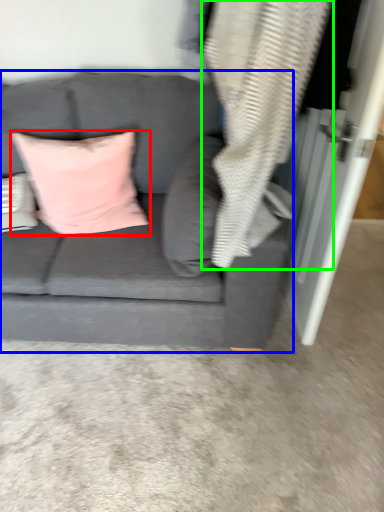
Question: Which is nearer to the pillow (highlighted by a red box)? studio couch (highlighted by a blue box) or material (highlighted by a green box).

Choices:
 (A) studio couch
 (B) material

Answer: (A)